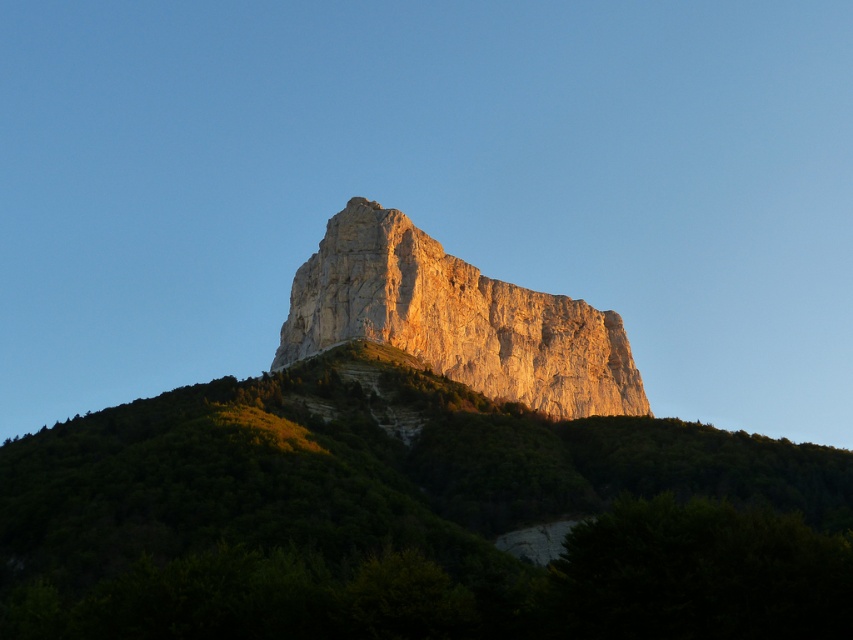
Is green textured hillside at center behind smooth beige rock at center?

No, green textured hillside at center is closer to the viewer.

Who is lower down, green textured hillside at center or smooth beige rock at center?

green textured hillside at center is lower down.

Which is in front, point (764, 636) or point (496, 285)?

Point (764, 636) is more forward.

Where is `green textured hillside at center`? green textured hillside at center is located at coordinates (410, 516).